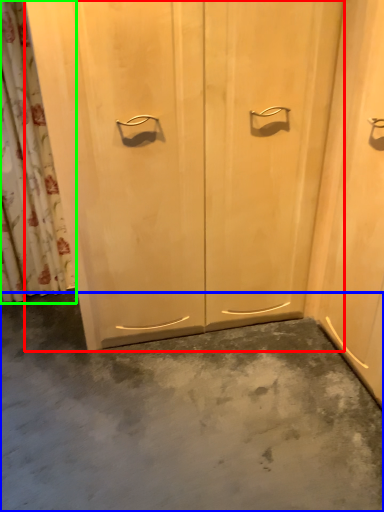
Question: Which object is positioned closest to door (highlighted by a red box)? Select from concrete (highlighted by a blue box) and shower curtain (highlighted by a green box).

Choices:
 (A) concrete
 (B) shower curtain

Answer: (A)